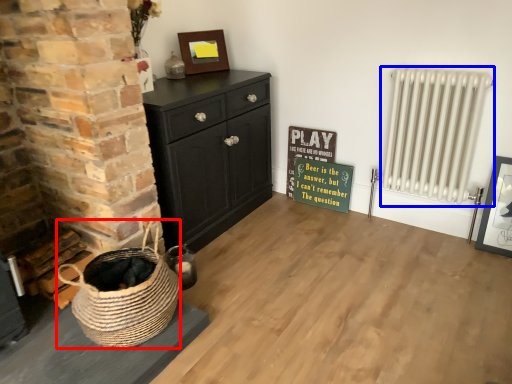
Question: Among these objects, which one is nearest to the camera, basket (highlighted by a red box) or radiator (highlighted by a blue box)?

Choices:
 (A) basket
 (B) radiator

Answer: (A)